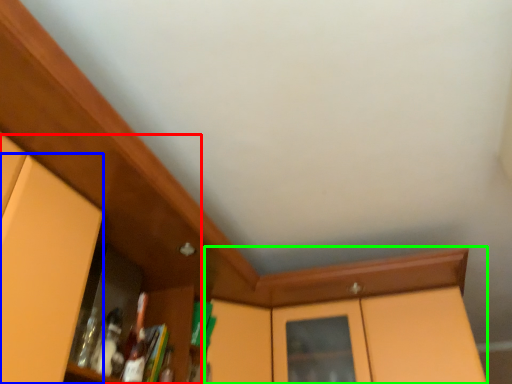
Question: Estimate the real-world distances between objects in this image. Which object is farther from dresser (highlighted by a red box), door (highlighted by a blue box) or cabinetry (highlighted by a green box)?

Choices:
 (A) door
 (B) cabinetry

Answer: (B)